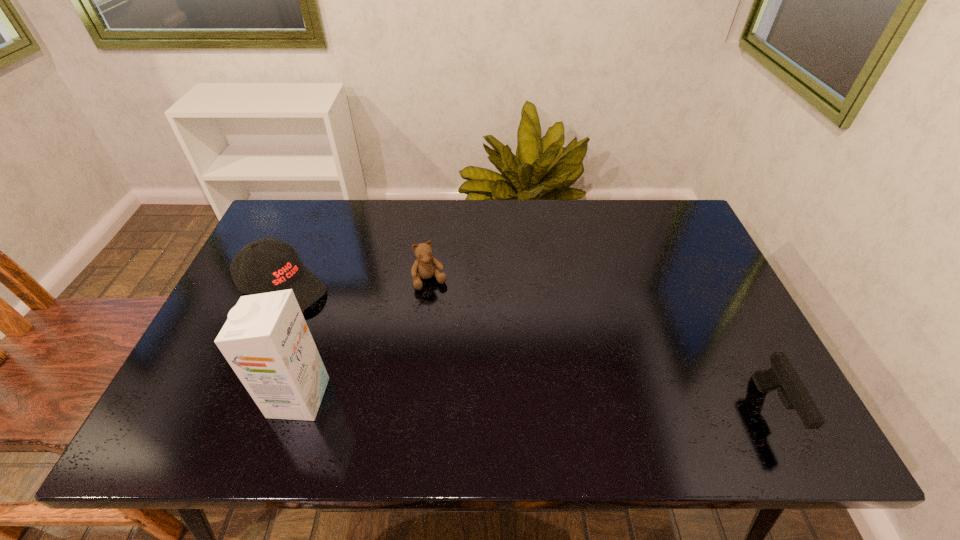
The image size is (960, 540). What are the coordinates of `the tallest object` in the screenshot? It's located at (266, 340).

The image size is (960, 540). What are the coordinates of `pistol` in the screenshot? It's located at (782, 376).

Locate an element on the screen. baseball cap is located at coordinates (282, 269).

You are a GUI agent. You are given a task and a screenshot of the screen. Output one action in this format:
    pyautogui.click(x=<x>, y=<y>)
    Task: Click on the teddy bear
    The image size is (960, 540).
    Given the screenshot: What is the action you would take?
    pyautogui.click(x=425, y=266)

The height and width of the screenshot is (540, 960). Identify the location of vacant area situated on the back of the carton. (325, 316).

Locate an element on the screen. Image resolution: width=960 pixels, height=540 pixels. free region located 0.090m on the front-facing side of the baseball cap is located at coordinates (339, 320).

What are the coordinates of `free space located 0.270m on the front-facing side of the baseball cap` in the screenshot? It's located at (391, 352).

I want to click on vacant region located 0.330m on the front-facing side of the baseball cap, so click(409, 364).

Where is `free spot located 0.290m on the front-facing side of the second object from right to left`? The image size is (960, 540). free spot located 0.290m on the front-facing side of the second object from right to left is located at coordinates (472, 376).

Where is `vacant space located 0.100m on the front-facing side of the second object from right to left`? The height and width of the screenshot is (540, 960). vacant space located 0.100m on the front-facing side of the second object from right to left is located at coordinates (446, 318).